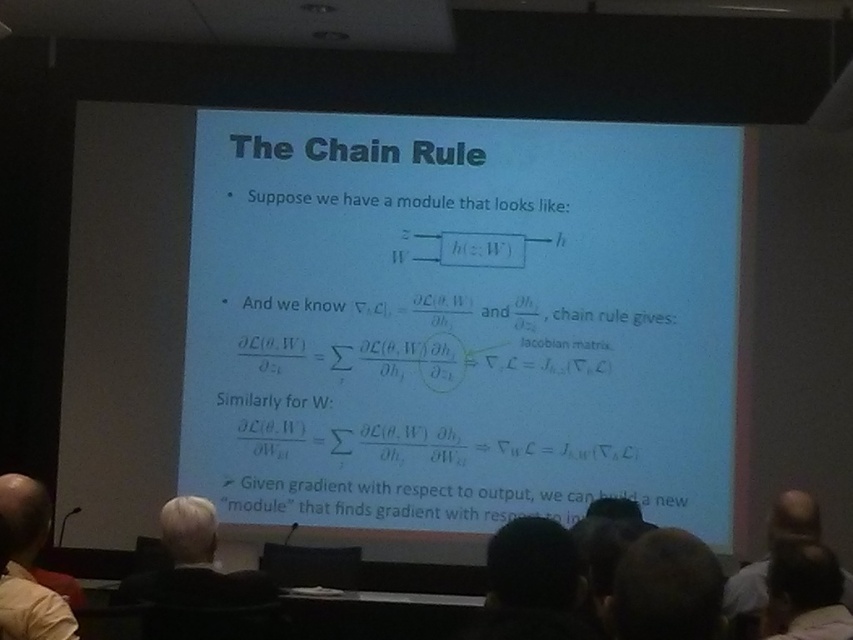
Can you confirm if light beige shirt at lower left is taller than gray hair at lower right?

Yes, light beige shirt at lower left is taller than gray hair at lower right.

Based on the photo, between light beige shirt at lower left and gray hair at lower right, which one has less height?

gray hair at lower right

Between point (76, 632) and point (788, 524), which one is positioned behind?

The point (788, 524) is behind.

The width and height of the screenshot is (853, 640). I want to click on light beige shirt at lower left, so click(x=28, y=566).

Between white paper at center and light beige shirt at lower left, which one is positioned lower?

light beige shirt at lower left is below.

Can you confirm if white paper at center is taller than light beige shirt at lower left?

Yes, white paper at center is taller than light beige shirt at lower left.

Find the location of a particular element. white paper at center is located at coordinates (459, 320).

Between white hair at upper left and gray hair at lower right, which one has more height?

With more height is white hair at upper left.

Which is above, white hair at upper left or gray hair at lower right?

Positioned higher is white hair at upper left.

This screenshot has width=853, height=640. I want to click on white hair at upper left, so click(200, 582).